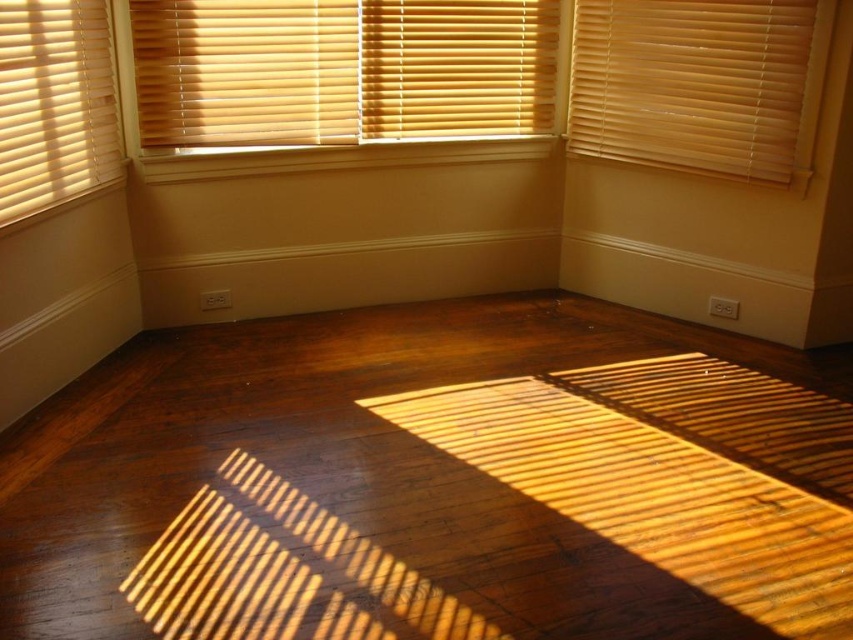
Is wooden blinds at upper center smaller than wooden blinds at upper right?

Actually, wooden blinds at upper center might be larger than wooden blinds at upper right.

Between wooden blinds at upper center and wooden blinds at upper right, which one is positioned higher?

wooden blinds at upper center is above.

Is point (473, 93) positioned before point (744, 17)?

No, it is behind (744, 17).

You are a GUI agent. You are given a task and a screenshot of the screen. Output one action in this format:
    pyautogui.click(x=<x>, y=<y>)
    Task: Click on the wooden blinds at upper center
    This screenshot has width=853, height=640.
    Given the screenshot: What is the action you would take?
    pyautogui.click(x=341, y=68)

Between wooden blinds at upper center and beige wood blinds at left, which one is positioned higher?

Positioned higher is wooden blinds at upper center.

Does wooden blinds at upper center have a smaller size compared to beige wood blinds at left?

No.

What do you see at coordinates (341, 68) in the screenshot? This screenshot has height=640, width=853. I see `wooden blinds at upper center` at bounding box center [341, 68].

Where is `wooden blinds at upper center`? The image size is (853, 640). wooden blinds at upper center is located at coordinates (341, 68).

Which is more to the right, wooden blinds at upper right or beige wood blinds at left?

Positioned to the right is wooden blinds at upper right.

Does wooden blinds at upper right have a smaller size compared to beige wood blinds at left?

No, wooden blinds at upper right is not smaller than beige wood blinds at left.

Where is `wooden blinds at upper right`? wooden blinds at upper right is located at coordinates (695, 83).

This screenshot has height=640, width=853. I want to click on wooden blinds at upper right, so click(695, 83).